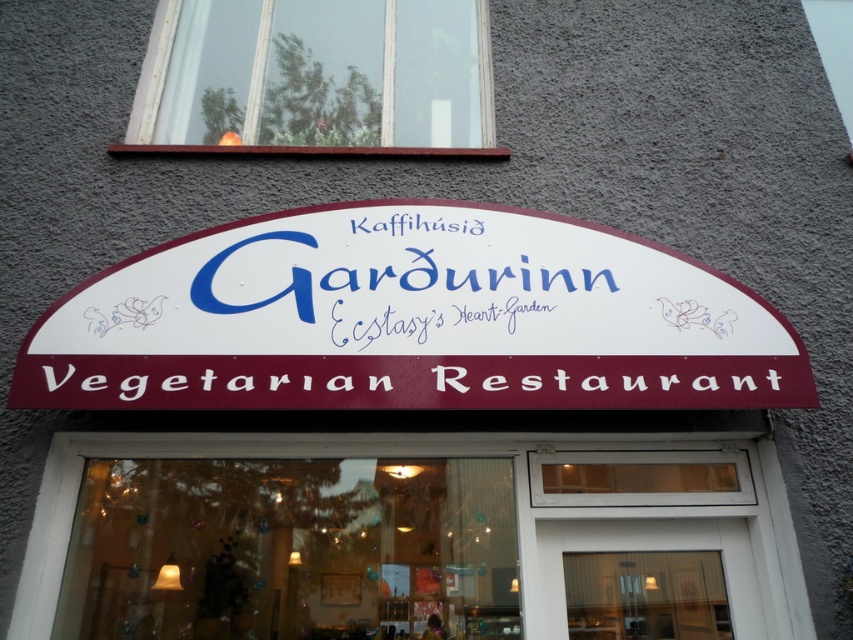
Between point (769, 346) and point (154, 109), which one is positioned behind?

Positioned behind is point (154, 109).

This screenshot has width=853, height=640. What do you see at coordinates (410, 321) in the screenshot?
I see `white plastic sign at center` at bounding box center [410, 321].

I want to click on white plastic sign at center, so tap(410, 321).

Is white plastic sign at center above white paper sign at center?

Indeed, white plastic sign at center is positioned over white paper sign at center.

Which is in front, point (402, 396) or point (469, 307)?

Point (402, 396) is in front.

Locate an element on the screen. white plastic sign at center is located at coordinates (410, 321).

Between point (432, 124) and point (408, 333), which one is positioned in front?

Point (408, 333)

Describe the element at coordinates (317, 77) in the screenshot. I see `white wood window at upper center` at that location.

I want to click on white wood window at upper center, so click(x=317, y=77).